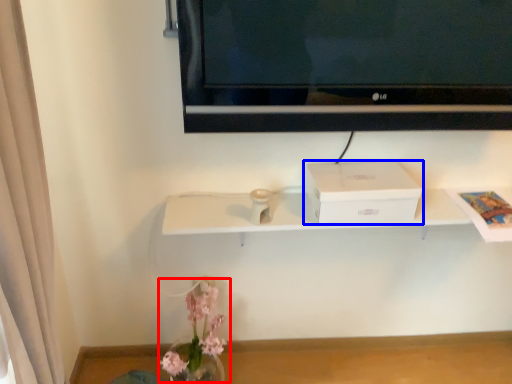
Question: Which of the following is the closest to the observer, floral arrangement (highlighted by a red box) or box (highlighted by a blue box)?

Choices:
 (A) floral arrangement
 (B) box

Answer: (A)